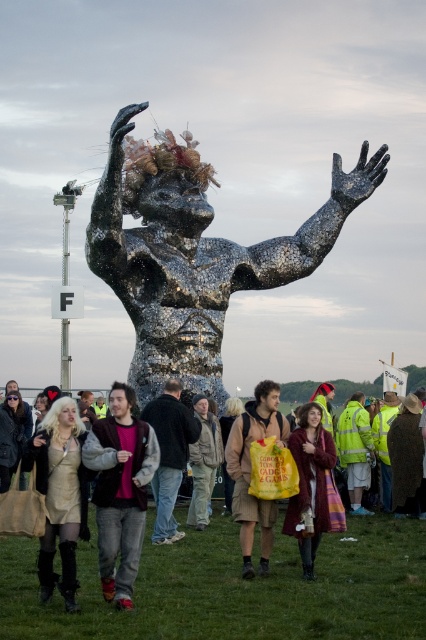
Is shiny metallic figure at center smaller than brown textured shorts at center?

Actually, shiny metallic figure at center might be larger than brown textured shorts at center.

Can you confirm if shiny metallic figure at center is bigger than brown textured shorts at center?

Indeed, shiny metallic figure at center has a larger size compared to brown textured shorts at center.

Is point (152, 164) more distant than point (250, 465)?

Yes, it is.

Find the location of a particular element. The width and height of the screenshot is (426, 640). shiny metallic figure at center is located at coordinates (195, 253).

Can you confirm if matte black jacket at center is smaller than jeans at center?

No, matte black jacket at center is not smaller than jeans at center.

Can you confirm if matte black jacket at center is positioned below jeans at center?

Yes, matte black jacket at center is below jeans at center.

Who is more distant from viewer, (x=172, y=616) or (x=154, y=529)?

The point (x=154, y=529) is behind.

Where is `matte black jacket at center`? The image size is (426, 640). matte black jacket at center is located at coordinates (236, 588).

Which is above, shiny metallic figure at center or yellow reflective jacket at center?

shiny metallic figure at center is above.

Consider the image. Can you confirm if shiny metallic figure at center is positioned above yellow reflective jacket at center?

Correct, shiny metallic figure at center is located above yellow reflective jacket at center.

Image resolution: width=426 pixels, height=640 pixels. What are the coordinates of `shiny metallic figure at center` in the screenshot? It's located at (195, 253).